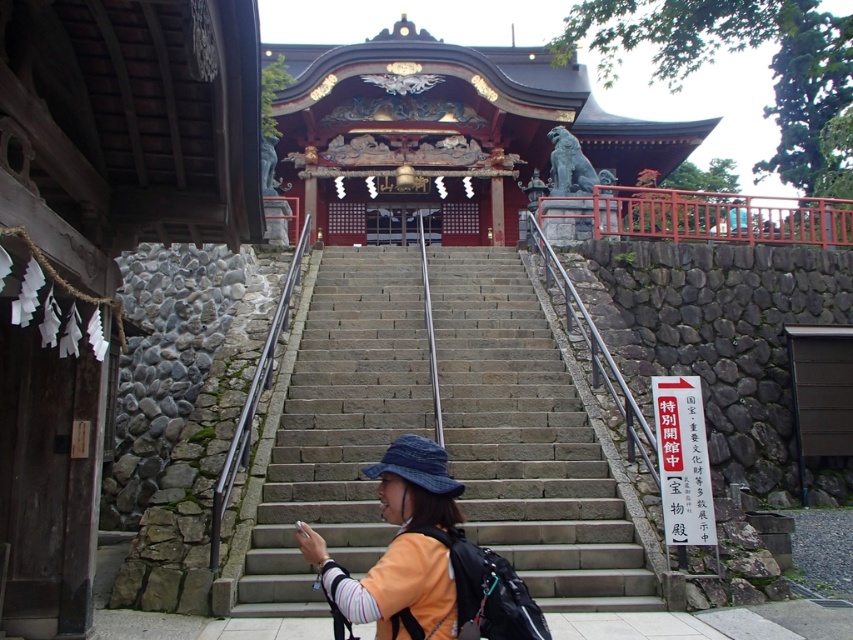
Question: Can you confirm if gray stone stairs at center is positioned to the left of orange fabric jacket at center?

Choices:
 (A) no
 (B) yes

Answer: (A)

Question: Does gray stone stairs at center appear on the right side of orange fabric jacket at center?

Choices:
 (A) yes
 (B) no

Answer: (A)

Question: Which point is farther to the camera?

Choices:
 (A) (312, 540)
 (B) (440, 291)

Answer: (B)

Question: Is gray stone stairs at center above orange fabric jacket at center?

Choices:
 (A) no
 (B) yes

Answer: (B)